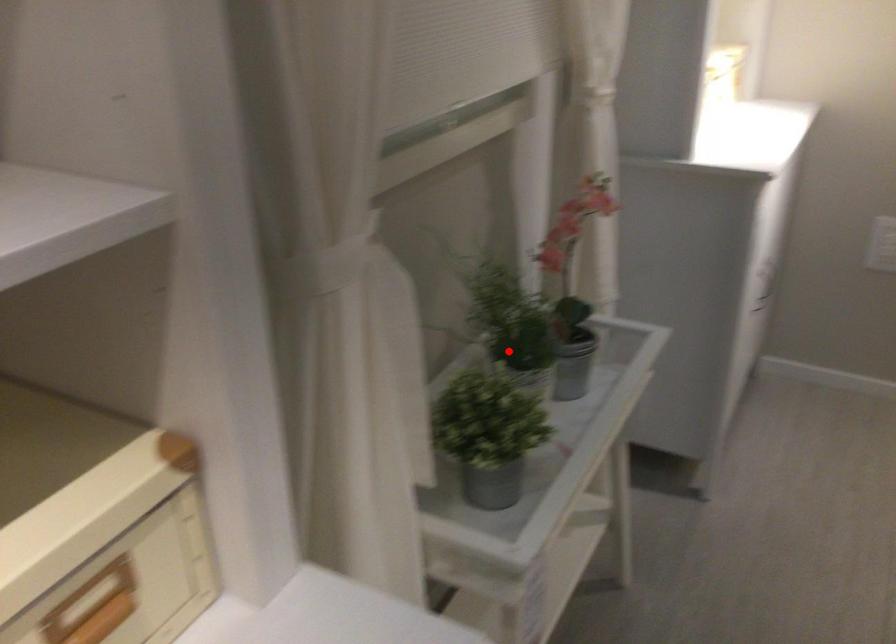
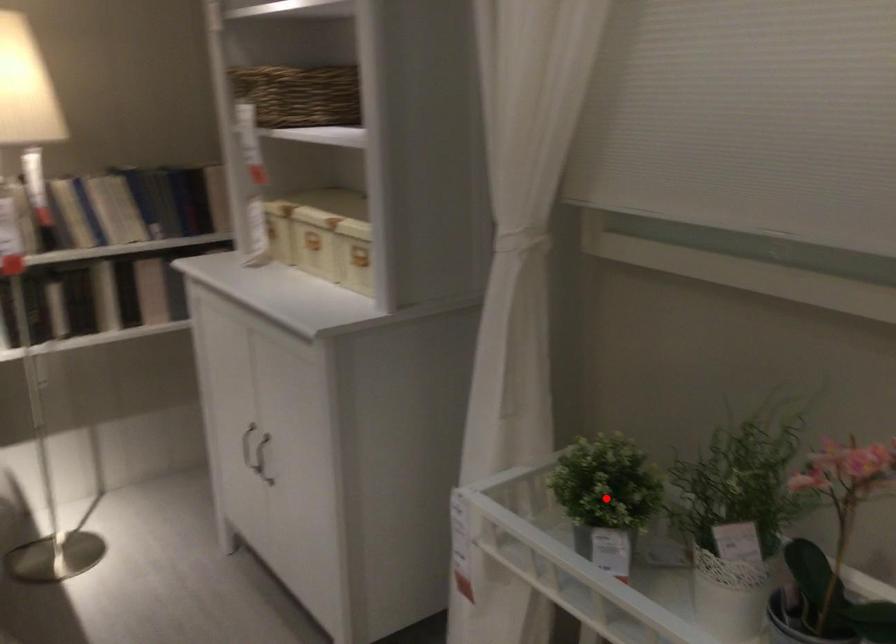
In the scene shown: I am providing you with two images of the same scene from different viewpoints. A red point is marked on the first image and another point is marked on the second image. Is the red point in image1 aligned with the point shown in image2?

No